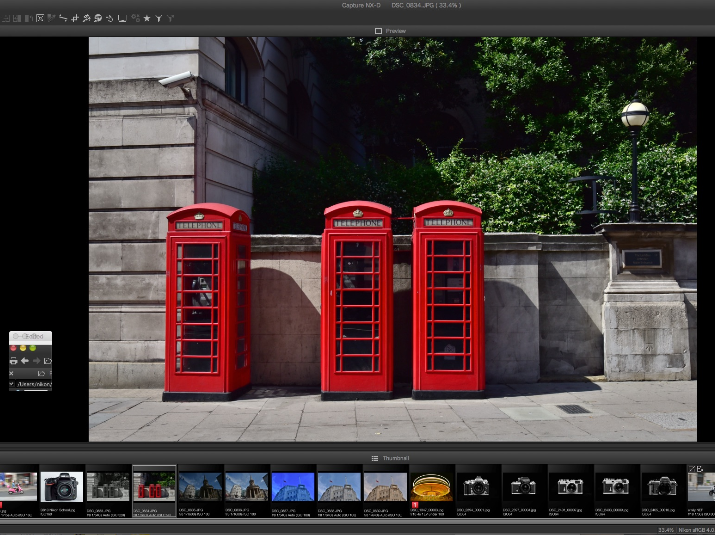
Identify the location of security camera. (182, 80), (174, 80).